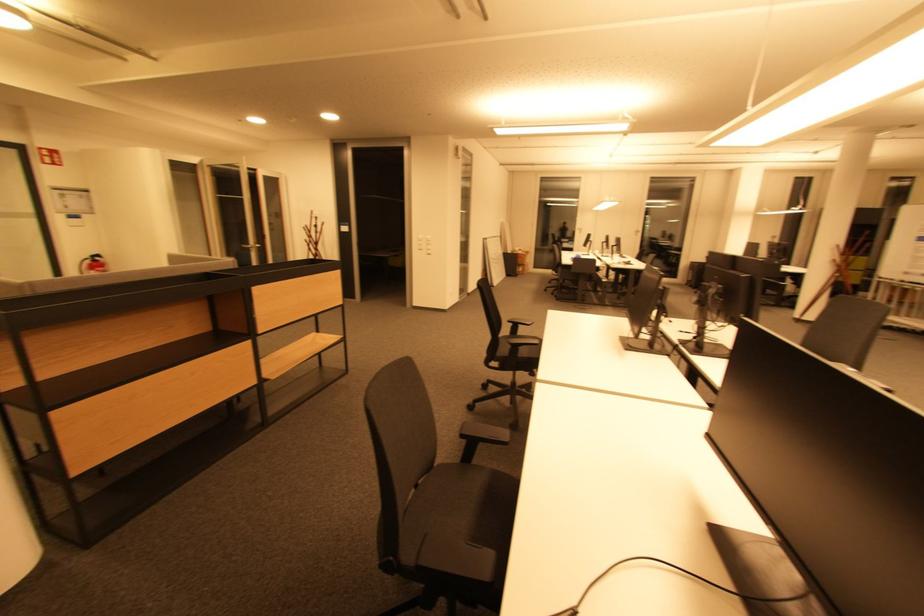
Where would you pull the door handle? Please return your answer as a coordinate pair (x, y).

(246, 245)